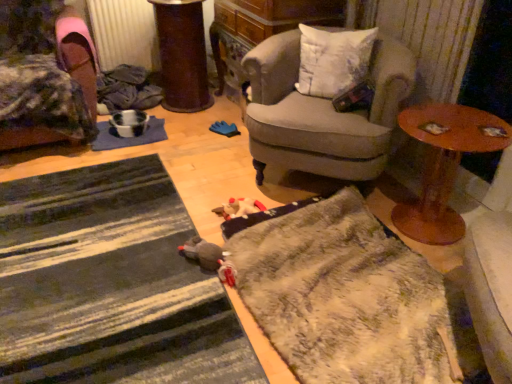
Question: In terms of height, does gray fabric armchair at center, arranged as the 2th chair when viewed from the left, look taller or shorter compared to white soft cushion at upper right?

Choices:
 (A) tall
 (B) short

Answer: (A)

Question: Based on their positions, is gray fabric armchair at center, arranged as the 2th chair when viewed from the left, located to the left or right of white soft cushion at upper right?

Choices:
 (A) right
 (B) left

Answer: (B)

Question: Which of these objects is positioned farthest from the white soft cushion at upper right?

Choices:
 (A) fuzzy gray doormat at lower center, which appears as the 2th doormat when viewed from the left
 (B) blue fabric mat at center-left
 (C) metallic silver radiator at upper left
 (D) gray fabric armchair at center, arranged as the 2th chair when viewed from the left
 (E) striped fabric doormat at lower left, placed as the 2th doormat when sorted from right to left

Answer: (C)

Question: Considering the real-world distances, which object is closest to the striped fabric doormat at lower left, the 1th doormat in the left-to-right sequence?

Choices:
 (A) white soft cushion at upper right
 (B) velvet fabric chair at left, which is the 1th chair from left to right
 (C) metallic silver radiator at upper left
 (D) gray fabric armchair at center, arranged as the first chair when viewed from the right
 (E) fuzzy gray doormat at lower center, positioned as the 1th doormat in right-to-left order

Answer: (E)